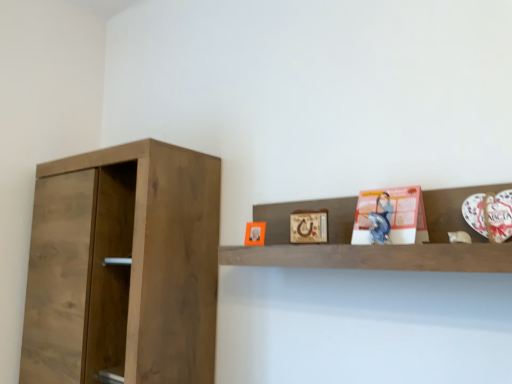
Locate an element on the screen. wooden shelf at upper center is located at coordinates click(x=375, y=245).

The height and width of the screenshot is (384, 512). Describe the element at coordinates (375, 245) in the screenshot. I see `wooden shelf at upper center` at that location.

What do you see at coordinates (309, 226) in the screenshot?
I see `wooden picture frame at upper center, which is the second picture frame from left to right` at bounding box center [309, 226].

Find the location of a particular element. The height and width of the screenshot is (384, 512). matte orange picture frame at upper center, which is the 1th picture frame in left-to-right order is located at coordinates (255, 234).

Where is `wooden shelf at upper center`? Image resolution: width=512 pixels, height=384 pixels. wooden shelf at upper center is located at coordinates (x=375, y=245).

Are walnut wood cupboard at left and matte orange picture frame at upper center, the second picture frame from the front, making contact?

walnut wood cupboard at left and matte orange picture frame at upper center, the second picture frame from the front, are not in contact.

From the image's perspective, is walnut wood cupboard at left positioned above or below matte orange picture frame at upper center, which is the 1th picture frame in left-to-right order?

Clearly, from the image's perspective, walnut wood cupboard at left is below matte orange picture frame at upper center, which is the 1th picture frame in left-to-right order.

Considering the sizes of objects walnut wood cupboard at left and matte orange picture frame at upper center, the second picture frame from the front, in the image provided, who is thinner, walnut wood cupboard at left or matte orange picture frame at upper center, the second picture frame from the front,?

Thinner between the two is matte orange picture frame at upper center, the second picture frame from the front.

How different are the orientations of matte pink paper at upper right and wooden shelf at upper center in degrees?

The angular difference between matte pink paper at upper right and wooden shelf at upper center is 1.16 degrees.

From the image's perspective, is matte pink paper at upper right beneath wooden shelf at upper center?

No.

Is wooden shelf at upper center at the back of matte pink paper at upper right?

Yes, matte pink paper at upper right's orientation is away from wooden shelf at upper center.

Is wooden shelf at upper center inside matte pink paper at upper right?

No, wooden shelf at upper center is not surrounded by matte pink paper at upper right.

You are a GUI agent. You are given a task and a screenshot of the screen. Output one action in this format:
    pyautogui.click(x=<x>, y=<y>)
    Task: Click on the picture frame that appears on the left of wooden picture frame at upper center, positioned as the first picture frame in front-to-back order
    
    Given the screenshot: What is the action you would take?
    pyautogui.click(x=255, y=234)

From the image's perspective, which is above, matte orange picture frame at upper center, which is the 1th picture frame in left-to-right order, or wooden picture frame at upper center, placed as the 1th picture frame when sorted from right to left?

wooden picture frame at upper center, placed as the 1th picture frame when sorted from right to left, appears higher in the image.

How many degrees apart are the facing directions of matte orange picture frame at upper center, the second picture frame from the front, and wooden picture frame at upper center, which is the second picture frame from left to right?

They differ by 7.26 degrees in their facing directions.

Can you confirm if matte orange picture frame at upper center, which is counted as the first picture frame, starting from the back, is thinner than wooden picture frame at upper center, the 2th picture frame when ordered from back to front?

No, matte orange picture frame at upper center, which is counted as the first picture frame, starting from the back, is not thinner than wooden picture frame at upper center, the 2th picture frame when ordered from back to front.

Can we say matte pink paper at upper right lies outside matte orange picture frame at upper center, the second picture frame from the front?

Yes, matte pink paper at upper right is located beyond the bounds of matte orange picture frame at upper center, the second picture frame from the front.

Where is `book that is in front of the matte orange picture frame at upper center, the second picture frame from the front`? The height and width of the screenshot is (384, 512). book that is in front of the matte orange picture frame at upper center, the second picture frame from the front is located at coordinates (390, 217).

Based on the photo, from the image's perspective, which one is positioned lower, matte pink paper at upper right or matte orange picture frame at upper center, which is the 1th picture frame in left-to-right order?

matte orange picture frame at upper center, which is the 1th picture frame in left-to-right order, is shown below in the image.

From a real-world perspective, is wooden shelf at upper center over matte pink paper at upper right?

Incorrect, from a real-world perspective, wooden shelf at upper center is lower than matte pink paper at upper right.

Would you say wooden shelf at upper center is inside or outside matte pink paper at upper right?

wooden shelf at upper center is not enclosed by matte pink paper at upper right.

Can you confirm if wooden shelf at upper center is shorter than matte pink paper at upper right?

No, wooden shelf at upper center is not shorter than matte pink paper at upper right.

Which is in front, point (159, 282) or point (413, 245)?

The point (413, 245) is closer.

Is walnut wood cupboard at left inside the boundaries of wooden shelf at upper center, or outside?

walnut wood cupboard at left is located beyond the bounds of wooden shelf at upper center.

Considering the sizes of objects walnut wood cupboard at left and wooden shelf at upper center in the image provided, who is wider, walnut wood cupboard at left or wooden shelf at upper center?

walnut wood cupboard at left is wider.

From the picture: Are walnut wood cupboard at left and wooden shelf at upper center located far from each other?

walnut wood cupboard at left is actually quite close to wooden shelf at upper center.

Is wooden shelf at upper center positioned far away from walnut wood cupboard at left?

No, wooden shelf at upper center is not far away from walnut wood cupboard at left.

Is wooden shelf at upper center at the left side of walnut wood cupboard at left?

In fact, wooden shelf at upper center is to the right of walnut wood cupboard at left.

Where is `shelf that appears in front of the walnut wood cupboard at left`? The height and width of the screenshot is (384, 512). shelf that appears in front of the walnut wood cupboard at left is located at coordinates (x=375, y=245).

In order to click on cupboard on the left of matte orange picture frame at upper center, which is counted as the first picture frame, starting from the back in this screenshot , I will do `click(124, 266)`.

Where is `book located above the wooden shelf at upper center (from a real-world perspective)`? The image size is (512, 384). book located above the wooden shelf at upper center (from a real-world perspective) is located at coordinates (390, 217).

Considering their positions, is matte pink paper at upper right positioned further to matte orange picture frame at upper center, which is counted as the first picture frame, starting from the back, than wooden shelf at upper center?

matte pink paper at upper right.

Estimate the real-world distances between objects in this image. Which object is closer to matte orange picture frame at upper center, the second picture frame from the front, wooden picture frame at upper center, the 2th picture frame when ordered from back to front, or matte pink paper at upper right?

wooden picture frame at upper center, the 2th picture frame when ordered from back to front, is closer to matte orange picture frame at upper center, the second picture frame from the front.

Looking at this image, looking at the image, which one is located further to matte pink paper at upper right, walnut wood cupboard at left or wooden picture frame at upper center, which is the second picture frame from left to right?

Among the two, walnut wood cupboard at left is located further to matte pink paper at upper right.

Considering their positions, is walnut wood cupboard at left positioned further to matte orange picture frame at upper center, positioned as the second picture frame in right-to-left order, than wooden shelf at upper center?

Among the two, walnut wood cupboard at left is located further to matte orange picture frame at upper center, positioned as the second picture frame in right-to-left order.

From the image, which object appears to be farther from wooden shelf at upper center, matte pink paper at upper right or wooden picture frame at upper center, which is the second picture frame from left to right?

wooden picture frame at upper center, which is the second picture frame from left to right, is positioned further to the anchor wooden shelf at upper center.

Looking at the image, which one is located closer to wooden shelf at upper center, walnut wood cupboard at left or matte orange picture frame at upper center, which is the 1th picture frame in left-to-right order?

matte orange picture frame at upper center, which is the 1th picture frame in left-to-right order.

From the image, which object appears to be nearer to matte pink paper at upper right, wooden picture frame at upper center, the 2th picture frame when ordered from back to front, or wooden shelf at upper center?

wooden shelf at upper center.

Considering their positions, is wooden shelf at upper center positioned closer to wooden picture frame at upper center, which is the second picture frame from left to right, than matte orange picture frame at upper center, the second picture frame from the front?

wooden shelf at upper center.

I want to click on book positioned between wooden shelf at upper center and matte orange picture frame at upper center, which is the 1th picture frame in left-to-right order, from near to far, so click(390, 217).

Find the location of a particular element. The image size is (512, 384). book positioned between wooden shelf at upper center and wooden picture frame at upper center, the 2th picture frame when ordered from back to front, from near to far is located at coordinates (390, 217).

Locate an element on the screen. Image resolution: width=512 pixels, height=384 pixels. picture frame located between wooden shelf at upper center and matte orange picture frame at upper center, which is counted as the first picture frame, starting from the back, in the depth direction is located at coordinates (309, 226).

The height and width of the screenshot is (384, 512). I want to click on picture frame between walnut wood cupboard at left and wooden picture frame at upper center, the 2th picture frame when ordered from back to front, from left to right, so click(x=255, y=234).